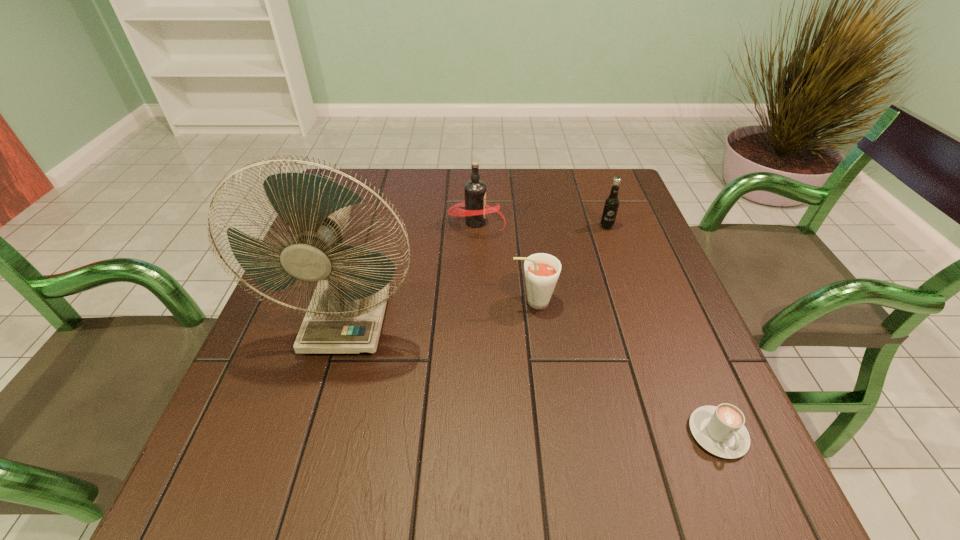
This screenshot has width=960, height=540. Identify the location of vacant space that's between the shortest object and the nearest root beer. (625, 367).

This screenshot has height=540, width=960. I want to click on empty location between the fourth shortest object and the tallest object, so click(x=412, y=272).

Identify the location of empty space between the leftmost object and the cappuccino. (533, 377).

Identify which object is the fourth closest to the nearest root beer. Please provide its 2D coordinates. Your answer should be formatted as a tuple, i.e. [(x, y)], where the tuple contains the x and y coordinates of a point satisfying the conditions above.

[(720, 430)]

Select which object is the third closest to the tallest root beer. Please provide its 2D coordinates. Your answer should be formatted as a tuple, i.e. [(x, y)], where the tuple contains the x and y coordinates of a point satisfying the conditions above.

[(611, 204)]

The image size is (960, 540). I want to click on root beer that is the third closest to the cappuccino, so click(476, 209).

The image size is (960, 540). Find the location of `root beer identified as the second closest to the tallest object`. root beer identified as the second closest to the tallest object is located at coordinates (476, 209).

This screenshot has height=540, width=960. In order to click on vacant region that satisfies the following two spatial constraints: 1. on the label of the fourth shortest object; 2. on the front-facing side of the fan in this screenshot , I will do `click(475, 321)`.

I want to click on free point that satisfies the following two spatial constraints: 1. on the drink side of the nearest root beer; 2. on the front-facing side of the fan, so click(535, 321).

At what (x,y) coordinates should I click in order to perform the action: click on free space that satisfies the following two spatial constraints: 1. on the drink side of the nearest root beer; 2. on the front-facing side of the leftmost object. Please return your answer as a coordinate pair (x, y). The height and width of the screenshot is (540, 960). Looking at the image, I should click on (535, 321).